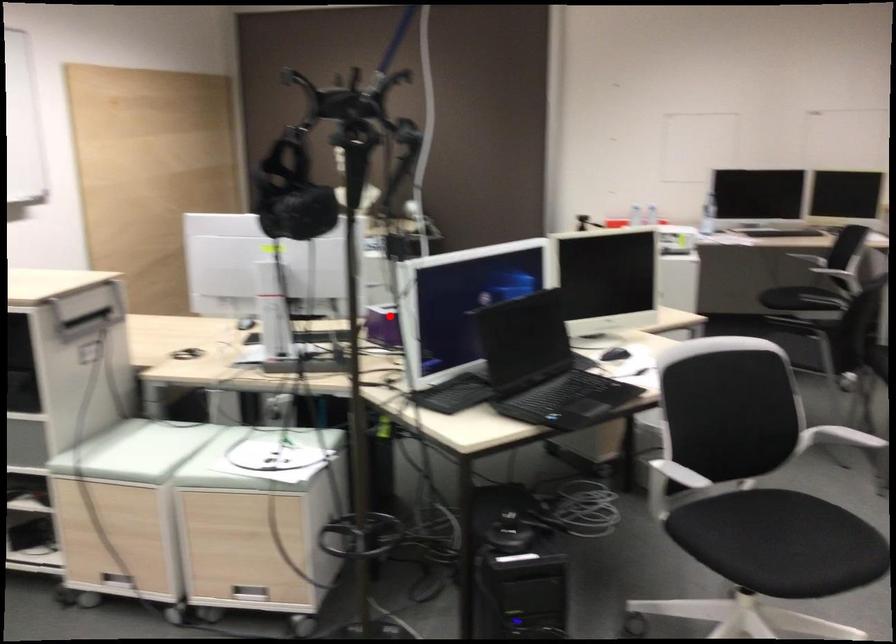
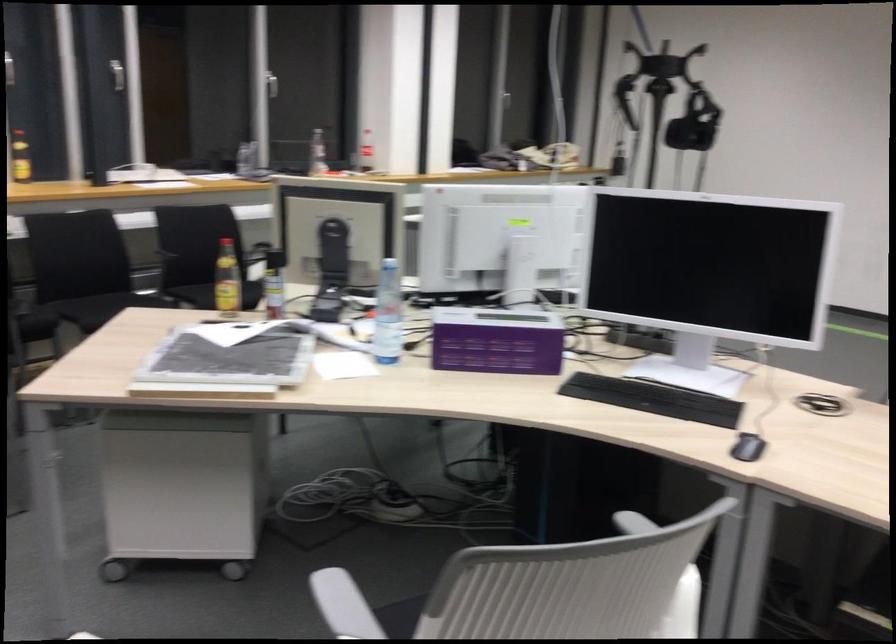
Question: I am providing you with two images of the same scene from different viewpoints. A red point is shown in image1. For the corresponding object point in image2, is it positioned nearer or farther from the camera?

Choices:
 (A) Nearer
 (B) Farther

Answer: (A)